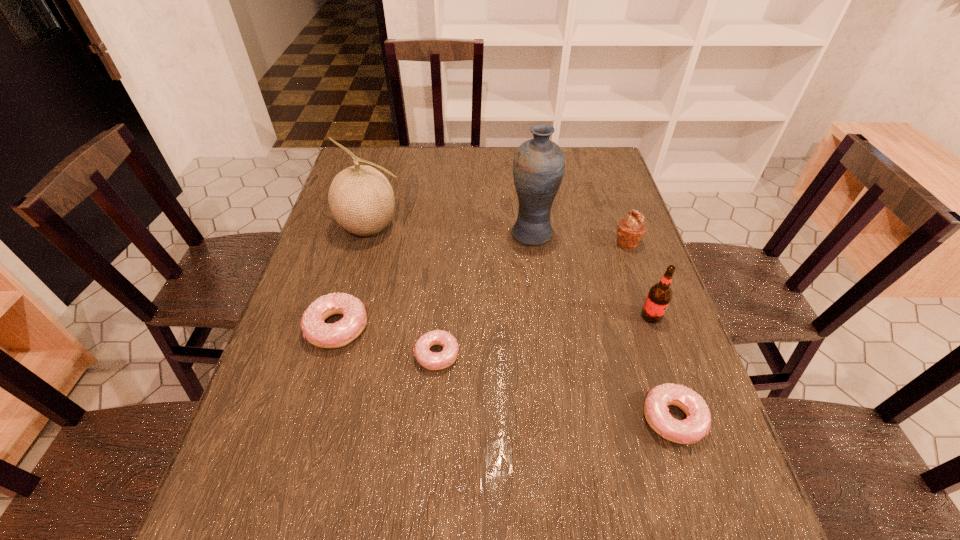
You are a GUI agent. You are given a task and a screenshot of the screen. Output one action in this format:
    pyautogui.click(x=<x>, y=<y>)
    Task: Click on the vacant space in between the tallest object and the leftmost doughnut
    This screenshot has width=960, height=540.
    Given the screenshot: What is the action you would take?
    [x=434, y=280]

Identify which object is the fourth nearest to the third object from left to right. Please provide its 2D coordinates. Your answer should be formatted as a tuple, i.e. [(x, y)], where the tuple contains the x and y coordinates of a point satisfying the conditions above.

[(697, 424)]

Identify which object is the closest to the third shortest object. Please provide its 2D coordinates. Your answer should be formatted as a tuple, i.e. [(x, y)], where the tuple contains the x and y coordinates of a point satisfying the conditions above.

[(433, 361)]

Identify which doughnut is the closest to the leftmost doughnut. Please provide its 2D coordinates. Your answer should be formatted as a tuple, i.e. [(x, y)], where the tuple contains the x and y coordinates of a point satisfying the conditions above.

[(433, 361)]

Point out which doughnut is positioned as the third nearest to the muffin. Please provide its 2D coordinates. Your answer should be formatted as a tuple, i.e. [(x, y)], where the tuple contains the x and y coordinates of a point satisfying the conditions above.

[(338, 334)]

I want to click on vacant region that satisfies the following two spatial constraints: 1. on the front side of the third object from left to right; 2. on the left side of the rightmost doughnut, so click(x=432, y=419).

In order to click on free spot that satisfies the following two spatial constraints: 1. on the front side of the fourth object from right to left; 2. on the right side of the root beer in this screenshot , I will do `click(541, 316)`.